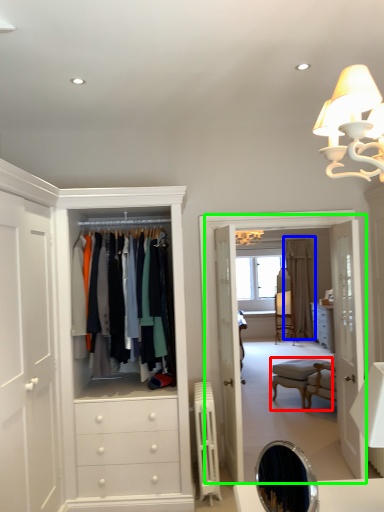
Question: Which object is positioned farthest from vanity (highlighted by a red box)? Select from curtain (highlighted by a blue box) and boutique (highlighted by a green box).

Choices:
 (A) curtain
 (B) boutique

Answer: (A)